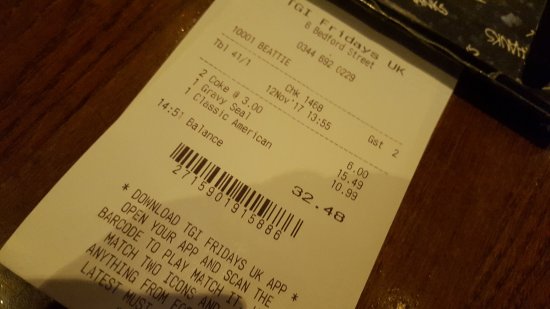
Find the location of `table`. table is located at coordinates (516, 240).